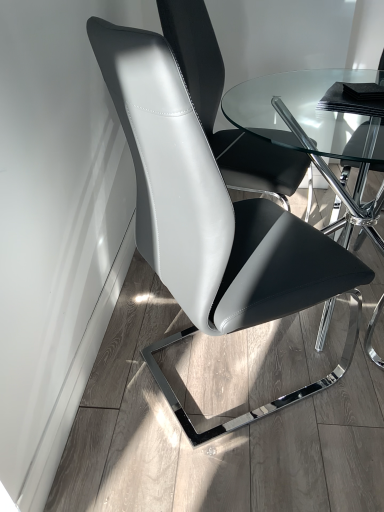
Question: From the image's perspective, would you say transparent glass table at center is positioned over white leather chair at center, which appears as the first chair when viewed from the back?

Choices:
 (A) yes
 (B) no

Answer: (B)

Question: Considering the relative positions of transparent glass table at center and white leather chair at center, which appears as the first chair when viewed from the back, in the image provided, is transparent glass table at center in front of white leather chair at center, which appears as the first chair when viewed from the back,?

Choices:
 (A) yes
 (B) no

Answer: (A)

Question: Is transparent glass table at center not inside white leather chair at center, the 2th chair viewed from the front?

Choices:
 (A) yes
 (B) no

Answer: (A)

Question: Does transparent glass table at center appear on the right side of white leather chair at center, which appears as the first chair when viewed from the back?

Choices:
 (A) no
 (B) yes

Answer: (B)

Question: Can you confirm if transparent glass table at center is smaller than white leather chair at center, which appears as the first chair when viewed from the back?

Choices:
 (A) yes
 (B) no

Answer: (B)

Question: Could you tell me if transparent glass table at center is turned towards white leather chair at center, the 2th chair viewed from the front?

Choices:
 (A) yes
 (B) no

Answer: (B)

Question: From a real-world perspective, is matte black chair at center, the 1th chair when ordered from front to back, below transparent glass table at center?

Choices:
 (A) yes
 (B) no

Answer: (B)

Question: Considering the relative sizes of matte black chair at center, positioned as the second chair in back-to-front order, and transparent glass table at center in the image provided, is matte black chair at center, positioned as the second chair in back-to-front order, taller than transparent glass table at center?

Choices:
 (A) no
 (B) yes

Answer: (B)

Question: Is matte black chair at center, the 1th chair when ordered from front to back, facing away from transparent glass table at center?

Choices:
 (A) no
 (B) yes

Answer: (B)

Question: Is matte black chair at center, positioned as the second chair in back-to-front order, further to camera compared to transparent glass table at center?

Choices:
 (A) yes
 (B) no

Answer: (B)

Question: Is matte black chair at center, positioned as the second chair in back-to-front order, bigger than transparent glass table at center?

Choices:
 (A) yes
 (B) no

Answer: (B)

Question: Can you confirm if matte black chair at center, positioned as the second chair in back-to-front order, is smaller than transparent glass table at center?

Choices:
 (A) yes
 (B) no

Answer: (A)

Question: From a real-world perspective, is matte black chair at center, positioned as the second chair in back-to-front order, physically below white leather chair at center, which appears as the first chair when viewed from the back?

Choices:
 (A) no
 (B) yes

Answer: (B)